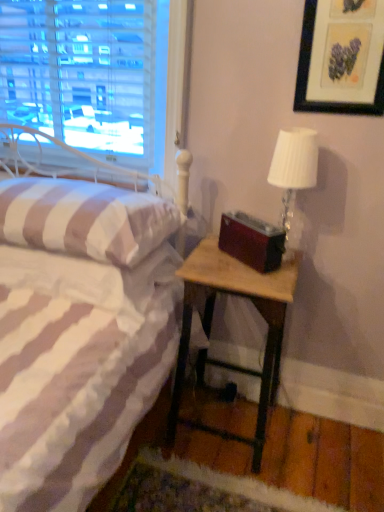
Find the location of a particular element. blank space to the left of wooden nightstand at lower right is located at coordinates (158, 437).